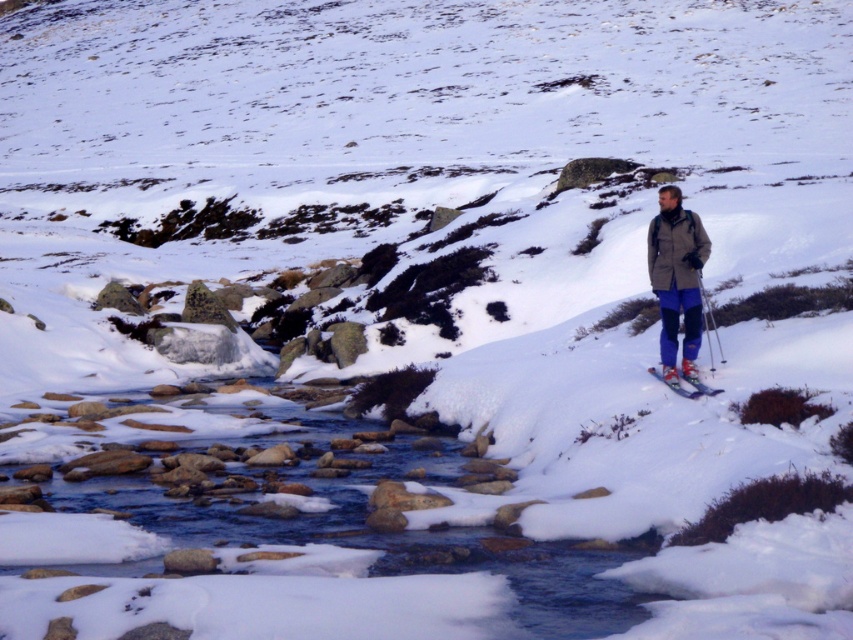
Describe the element at coordinates (676, 280) in the screenshot. The height and width of the screenshot is (640, 853). I see `matte gray jacket at right` at that location.

Who is more forward, (x=653, y=273) or (x=701, y=385)?

Positioned in front is point (x=701, y=385).

What do you see at coordinates (676, 280) in the screenshot?
I see `matte gray jacket at right` at bounding box center [676, 280].

Image resolution: width=853 pixels, height=640 pixels. Identify the location of matte gray jacket at right. (676, 280).